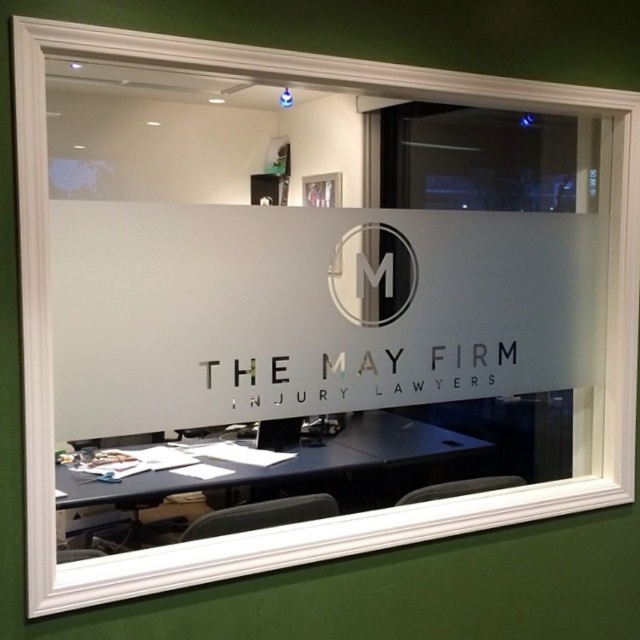
Which is more to the left, black glossy table at lower center or satin black circle at center?

black glossy table at lower center is more to the left.

Does black glossy table at lower center have a greater width compared to satin black circle at center?

Indeed, black glossy table at lower center has a greater width compared to satin black circle at center.

Is point (480, 467) positioned in front of point (348, 298)?

No, it is not.

At what (x,y) coordinates should I click in order to perform the action: click on black glossy table at lower center. Please return your answer as a coordinate pair (x, y). Looking at the image, I should click on (262, 480).